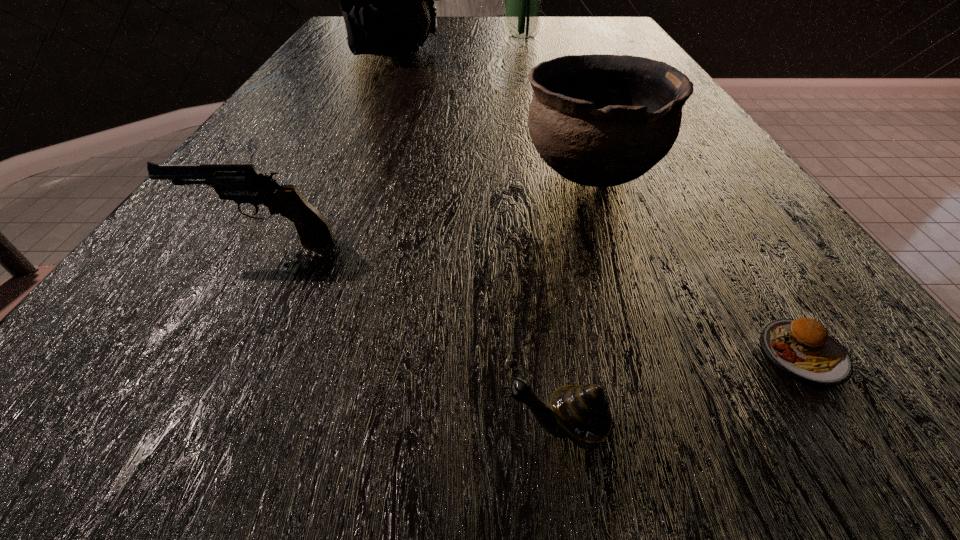
Locate an element on the screen. shoulder bag located at the far edge is located at coordinates (387, 0).

At what (x,y) coordinates should I click in order to perform the action: click on object that is at the near edge. Please return your answer as a coordinate pair (x, y). The height and width of the screenshot is (540, 960). Looking at the image, I should click on (581, 413).

You are a GUI agent. You are given a task and a screenshot of the screen. Output one action in this format:
    pyautogui.click(x=<x>, y=<y>)
    Task: Click on the shoulder bag that is at the left edge
    This screenshot has height=540, width=960.
    Given the screenshot: What is the action you would take?
    pyautogui.click(x=387, y=0)

The image size is (960, 540). I want to click on gun that is at the left edge, so click(238, 182).

You are a GUI agent. You are given a task and a screenshot of the screen. Output one action in this format:
    pyautogui.click(x=<x>, y=<y>)
    Task: Click on the pottery positioned at the right edge
    This screenshot has width=960, height=540.
    Given the screenshot: What is the action you would take?
    pyautogui.click(x=597, y=120)

Find the location of a particular element. patty present at the right edge is located at coordinates (803, 349).

Where is `object that is positioned at the far left corner`? This screenshot has height=540, width=960. object that is positioned at the far left corner is located at coordinates (387, 0).

Where is `free space at the far edge of the desktop`? free space at the far edge of the desktop is located at coordinates (466, 19).

The image size is (960, 540). I want to click on free location at the near edge, so click(510, 465).

I want to click on free space at the left edge, so click(339, 49).